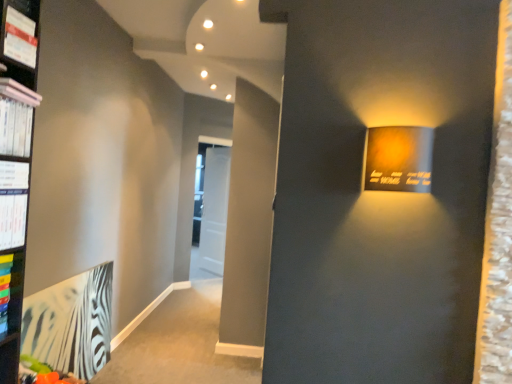
Question: Does matte white magazine at upper left, placed as the 1th magazine when sorted from top to bottom, have a greater width compared to pink matte book at upper left?

Choices:
 (A) no
 (B) yes

Answer: (A)

Question: Is matte white magazine at upper left, positioned as the second magazine in bottom-to-top order, touching pink matte book at upper left?

Choices:
 (A) yes
 (B) no

Answer: (B)

Question: Does matte white magazine at upper left, placed as the 1th magazine when sorted from top to bottom, appear on the right side of pink matte book at upper left?

Choices:
 (A) yes
 (B) no

Answer: (A)

Question: Does matte white magazine at upper left, positioned as the second magazine in bottom-to-top order, have a greater height compared to pink matte book at upper left?

Choices:
 (A) no
 (B) yes

Answer: (B)

Question: Is matte white magazine at upper left, positioned as the second magazine in bottom-to-top order, facing away from pink matte book at upper left?

Choices:
 (A) yes
 (B) no

Answer: (B)

Question: Does point (25, 102) appear closer or farther from the camera than point (14, 155)?

Choices:
 (A) farther
 (B) closer

Answer: (A)

Question: Which is correct: pink matte book at upper left is inside white glossy magazine at left, the 2th magazine from the top, or outside of it?

Choices:
 (A) inside
 (B) outside

Answer: (B)

Question: Would you say pink matte book at upper left is to the left or to the right of white glossy magazine at left, acting as the 1th magazine starting from the bottom, in the picture?

Choices:
 (A) left
 (B) right

Answer: (A)

Question: From a real-world perspective, is pink matte book at upper left positioned above or below white glossy magazine at left, acting as the 1th magazine starting from the bottom?

Choices:
 (A) below
 (B) above

Answer: (B)

Question: Would you say white paper at left, the first paperback book in the top-to-bottom sequence, is to the left or to the right of zebra-patterned paper at lower left, which is the 1th paperback book in bottom-to-top order, in the picture?

Choices:
 (A) right
 (B) left

Answer: (A)

Question: Is white paper at left, the second paperback book in the bottom-to-top sequence, taller or shorter than zebra-patterned paper at lower left, placed as the 2th paperback book when sorted from front to back?

Choices:
 (A) tall
 (B) short

Answer: (B)

Question: Is point (10, 208) closer or farther from the camera than point (104, 344)?

Choices:
 (A) farther
 (B) closer

Answer: (B)

Question: In terms of width, does white paper at left, which is the 2th paperback book in back-to-front order, look wider or thinner when compared to zebra-patterned paper at lower left, the 1th paperback book positioned from the back?

Choices:
 (A) wide
 (B) thin

Answer: (A)

Question: From a real-world perspective, relative to pink matte book at upper left, is matte white magazine at upper left, placed as the 1th magazine when sorted from top to bottom, vertically above or below?

Choices:
 (A) below
 (B) above

Answer: (B)

Question: From their relative heights in the image, would you say matte white magazine at upper left, placed as the 1th magazine when sorted from top to bottom, is taller or shorter than pink matte book at upper left?

Choices:
 (A) tall
 (B) short

Answer: (A)